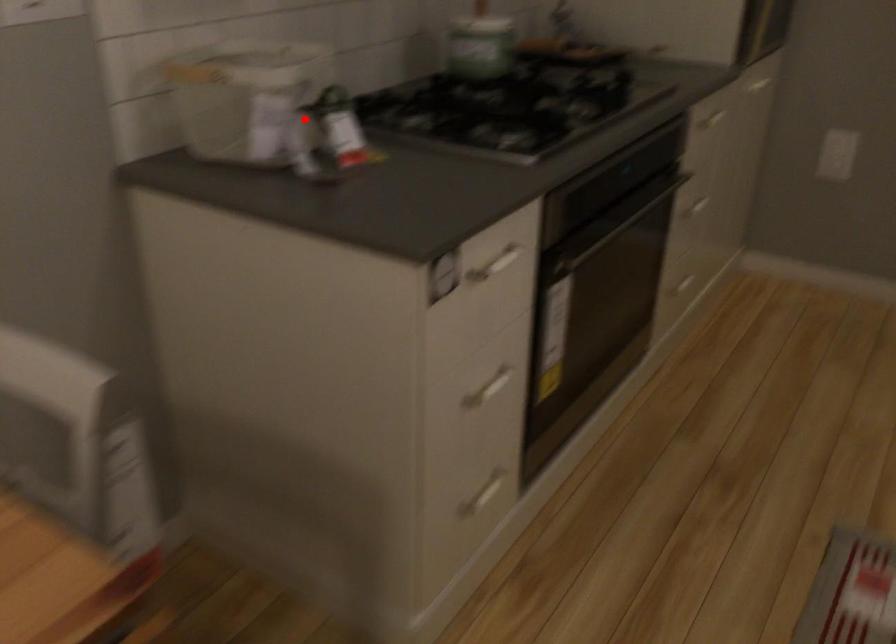
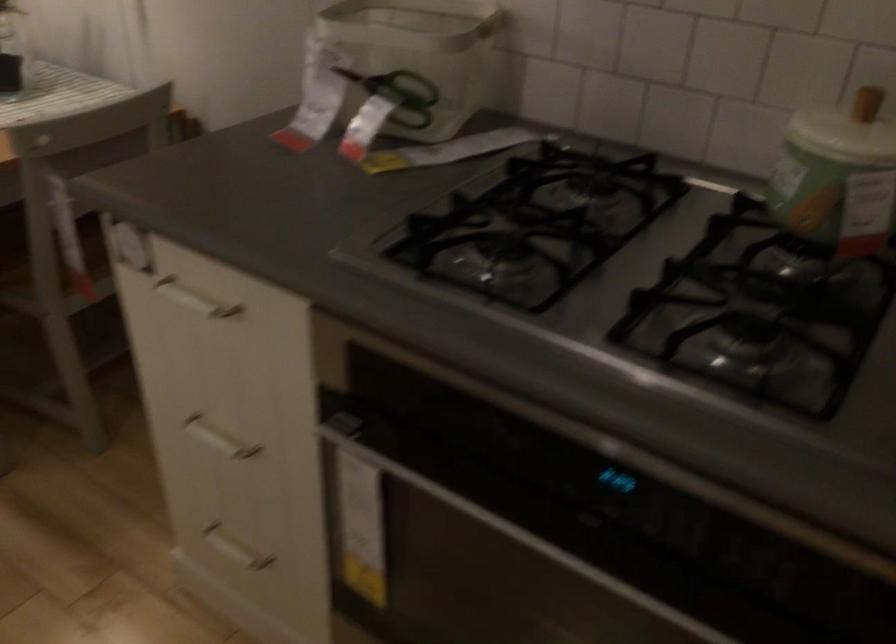
Question: A red point is marked in image1. In image2, is the corresponding 3D point closer to the camera or farther? Reply with the corresponding letter.

Choices:
 (A) The corresponding 3D point is closer.
 (B) The corresponding 3D point is farther.

Answer: (A)